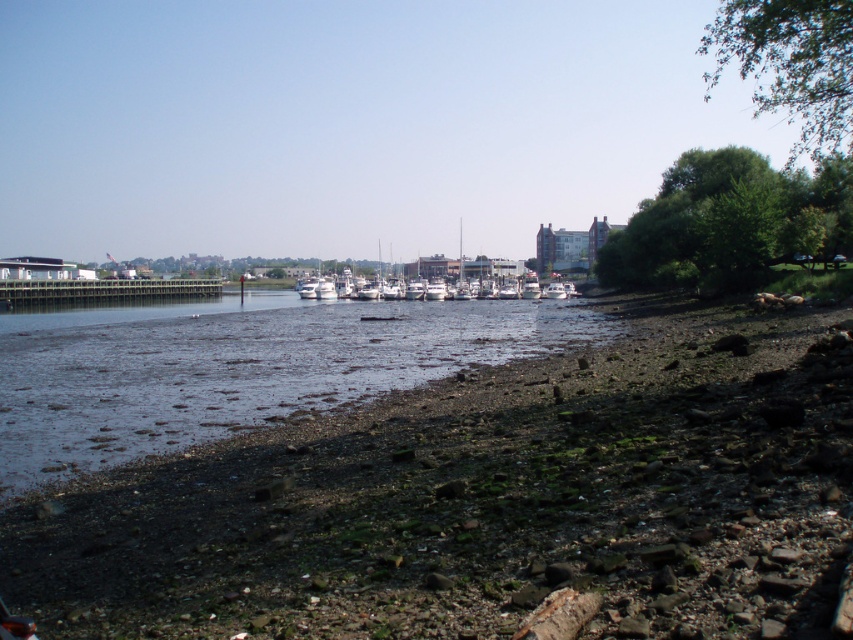
Which of these two, brown gravel river at center or white glossy boats at center, stands shorter?

Standing shorter between the two is brown gravel river at center.

Does point (248, 410) lie behind point (482, 259)?

No, it is not.

The image size is (853, 640). What are the coordinates of `brown gravel river at center` in the screenshot? It's located at (236, 365).

Between dull brown pebbles at lower left and brown gravel river at center, which one appears on the right side from the viewer's perspective?

dull brown pebbles at lower left

You are a GUI agent. You are given a task and a screenshot of the screen. Output one action in this format:
    pyautogui.click(x=<x>, y=<y>)
    Task: Click on the dull brown pebbles at lower left
    
    Given the screenshot: What is the action you would take?
    pyautogui.click(x=485, y=502)

Does dull brown pebbles at lower left have a greater height compared to white glossy boat at center?

No, dull brown pebbles at lower left is not taller than white glossy boat at center.

Find the location of a particular element. The image size is (853, 640). dull brown pebbles at lower left is located at coordinates (485, 502).

The image size is (853, 640). What are the coordinates of `dull brown pebbles at lower left` in the screenshot? It's located at (485, 502).